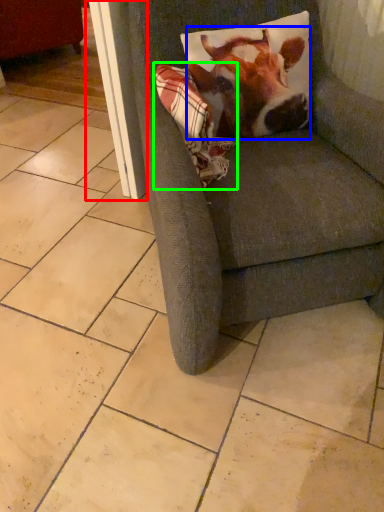
Question: Based on their relative distances, which object is nearer to screen door (highlighted by a red box)? Choose from cattle (highlighted by a blue box) and blanket (highlighted by a green box).

Choices:
 (A) cattle
 (B) blanket

Answer: (B)